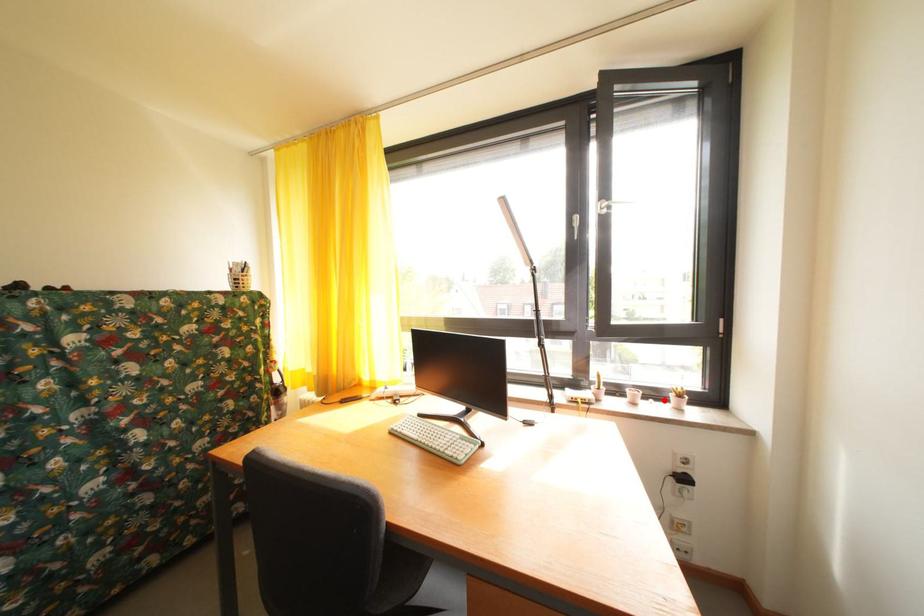
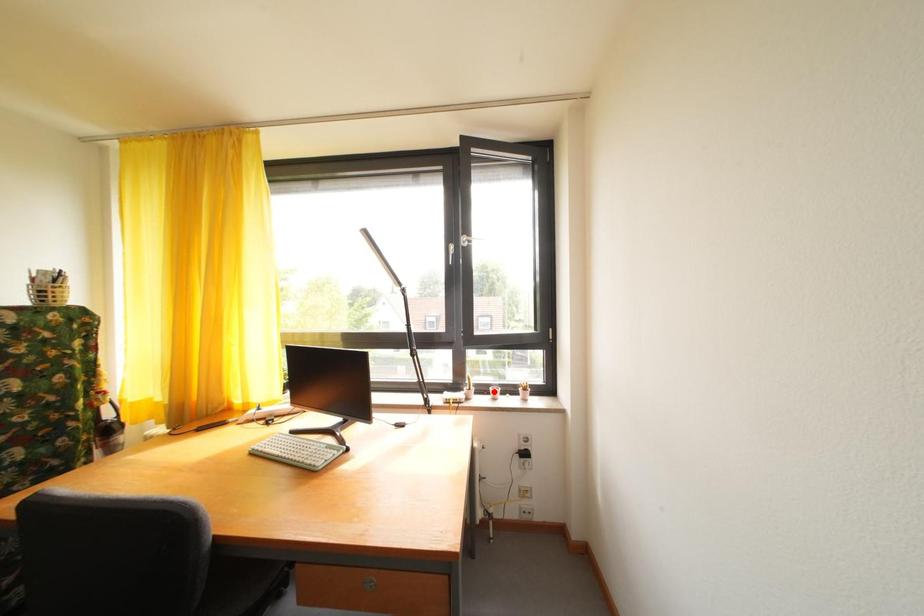
I am providing you with two images of the same scene from different viewpoints. A red point is marked on the first image and another point is marked on the second image. Does the point marked in image1 correspond to the same location as the one in image2?

No